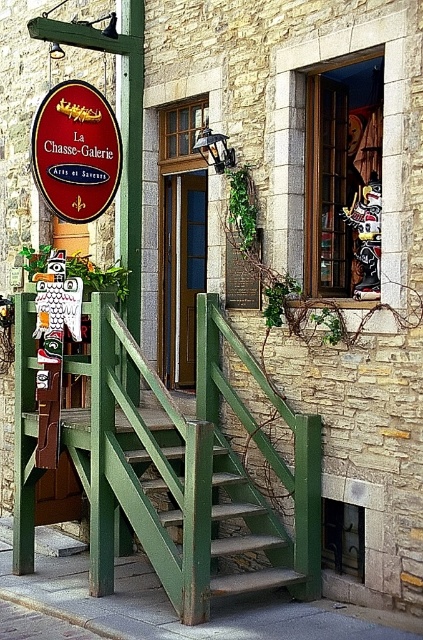
Question: Which is nearer to the matte red sign at upper left?

Choices:
 (A) green wooden stairs at center
 (B) green wood rail at center

Answer: (B)

Question: Estimate the real-world distances between objects in this image. Which object is farther from the green wood rail at center?

Choices:
 (A) green wooden stairs at center
 (B) matte red sign at upper left

Answer: (B)

Question: Can you confirm if green wood rail at center is smaller than matte red sign at upper left?

Choices:
 (A) no
 (B) yes

Answer: (A)

Question: Is green wooden stairs at center further to camera compared to matte red sign at upper left?

Choices:
 (A) no
 (B) yes

Answer: (A)

Question: Is green wood rail at center below matte red sign at upper left?

Choices:
 (A) no
 (B) yes

Answer: (B)

Question: Which object appears farthest from the camera in this image?

Choices:
 (A) green wooden stairs at center
 (B) matte red sign at upper left
 (C) green wood rail at center

Answer: (B)